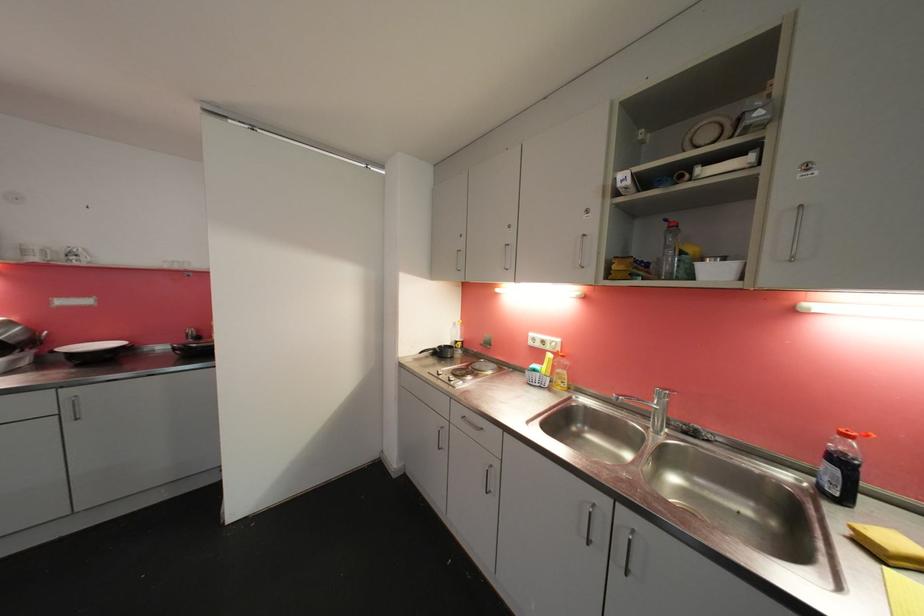
This screenshot has width=924, height=616. Find the location of `large white bowl`. large white bowl is located at coordinates (718, 269).